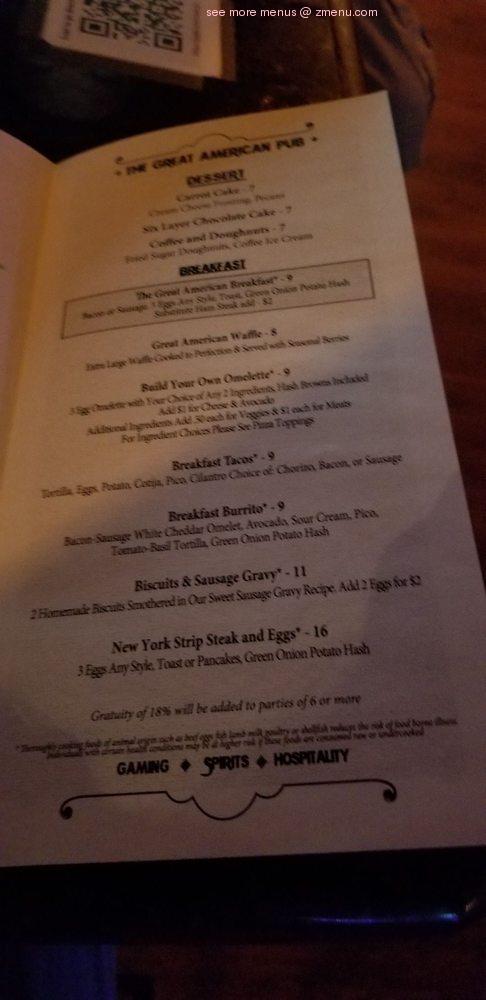
Locate an element on the screen. Image resolution: width=486 pixels, height=1000 pixels. edge of table is located at coordinates (223, 893).